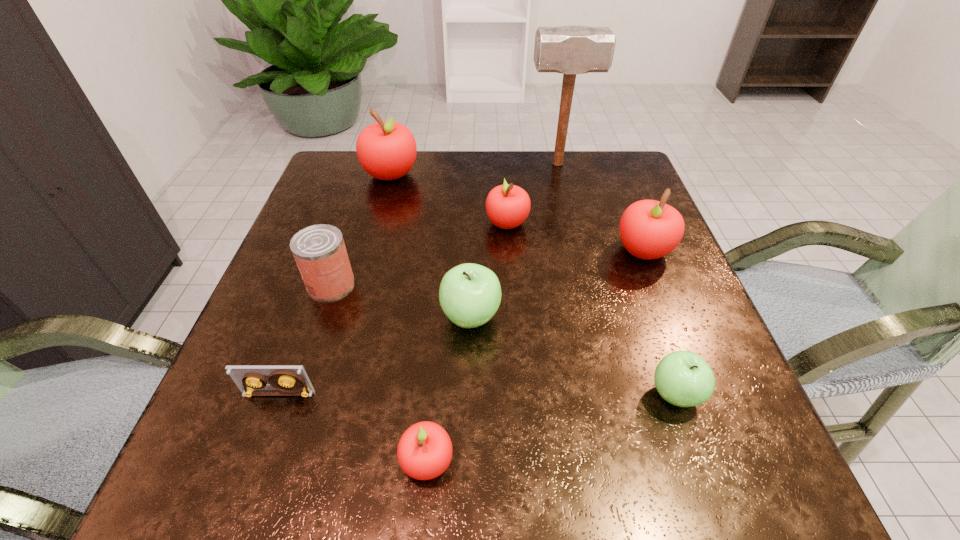
Identify the location of mallet. 571,49.

This screenshot has height=540, width=960. In order to click on the leftmost apple in this screenshot , I will do `click(386, 150)`.

This screenshot has height=540, width=960. Find the location of `the farthest apple`. the farthest apple is located at coordinates (386, 150).

Where is `the rightmost red apple`? The height and width of the screenshot is (540, 960). the rightmost red apple is located at coordinates (649, 229).

Image resolution: width=960 pixels, height=540 pixels. Find the location of `the fifth shortest apple`. the fifth shortest apple is located at coordinates (649, 229).

Where is `the third red apple from left to right`? The width and height of the screenshot is (960, 540). the third red apple from left to right is located at coordinates (507, 206).

I want to click on the farther green apple, so click(470, 294).

At what (x,y) coordinates should I click in order to perform the action: click on the left green apple. Please return your answer as a coordinate pair (x, y). Looking at the image, I should click on (470, 294).

The image size is (960, 540). I want to click on can, so click(319, 250).

This screenshot has height=540, width=960. Find the location of `the smaller green apple`. the smaller green apple is located at coordinates (683, 378).